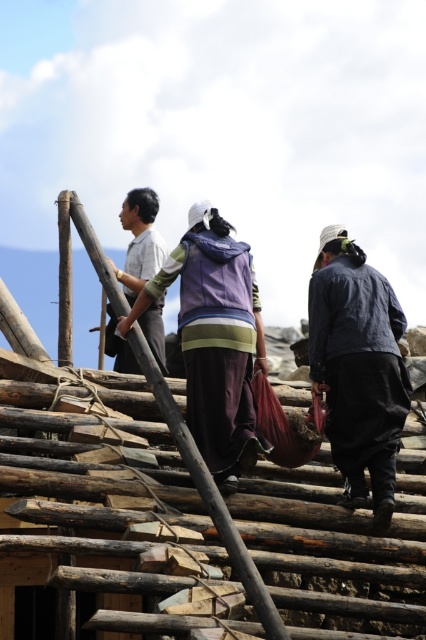
Which is behind, point (322, 339) or point (141, 234)?

The point (141, 234) is behind.

Between dark blue fabric at center and light gray striped shirt at upper left, which one appears on the left side from the viewer's perspective?

light gray striped shirt at upper left

Which is in front, point (353, 344) or point (115, 266)?

Point (353, 344)

This screenshot has height=640, width=426. Find the location of `dark blue fabric at center`. dark blue fabric at center is located at coordinates (357, 369).

Can you confirm if purple fabric at center is bigger than wooden at center?

No, purple fabric at center is not bigger than wooden at center.

Is purple fabric at center closer to the viewer compared to wooden at center?

No, purple fabric at center is further to the viewer.

Who is more distant from viewer, (189,292) or (94,259)?

The point (189,292) is behind.

Locate an element on the screen. Image resolution: width=426 pixels, height=640 pixels. purple fabric at center is located at coordinates tap(215, 339).

Who is higher up, purple fabric at center or light gray striped shirt at upper left?

light gray striped shirt at upper left

Does purple fabric at center have a larger size compared to light gray striped shirt at upper left?

No.

Does point (230, 340) come closer to viewer compared to point (163, 260)?

Yes, it is in front of point (163, 260).

You are a GUI agent. You are given a task and a screenshot of the screen. Output one action in this format:
    pyautogui.click(x=<x>, y=<y>)
    Task: Click on the purple fabric at center
    This screenshot has height=640, width=426.
    Given the screenshot: What is the action you would take?
    pyautogui.click(x=215, y=339)